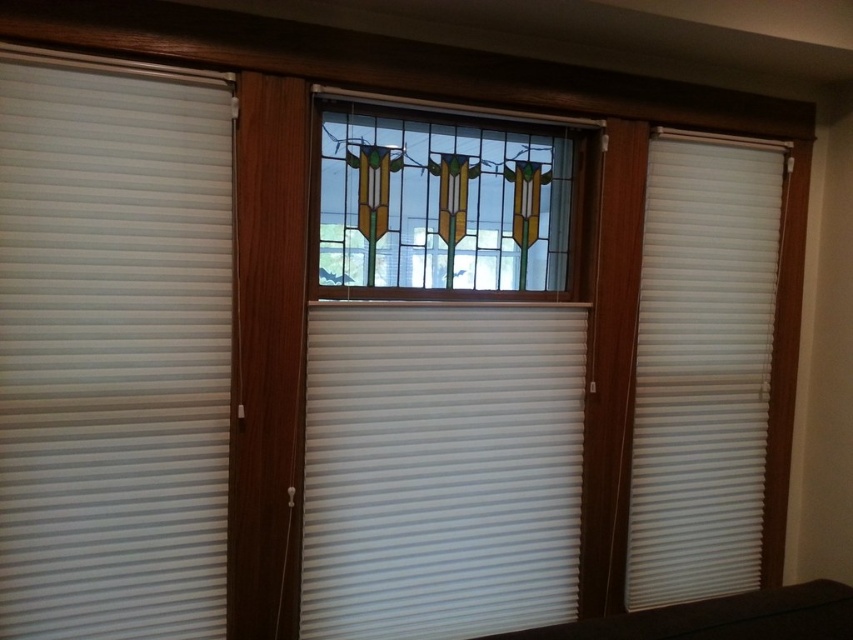
Based on the photo, who is taller, white matte blinds at left or white pleated blind at center?

white matte blinds at left is taller.

What are the coordinates of `white matte blinds at left` in the screenshot? It's located at (112, 348).

The height and width of the screenshot is (640, 853). In order to click on white matte blinds at left in this screenshot , I will do `click(112, 348)`.

Consider the image. Can you confirm if white pleated blind at center is positioned to the right of white matte blind at right?

Incorrect, white pleated blind at center is not on the right side of white matte blind at right.

In order to click on white pleated blind at center in this screenshot , I will do `click(440, 467)`.

Locate an element on the screen. The width and height of the screenshot is (853, 640). white pleated blind at center is located at coordinates (440, 467).

Looking at this image, which is above, white matte blinds at left or white matte blind at right?

Positioned higher is white matte blinds at left.

Image resolution: width=853 pixels, height=640 pixels. What do you see at coordinates (112, 348) in the screenshot?
I see `white matte blinds at left` at bounding box center [112, 348].

Locate an element on the screen. The image size is (853, 640). white matte blinds at left is located at coordinates (112, 348).